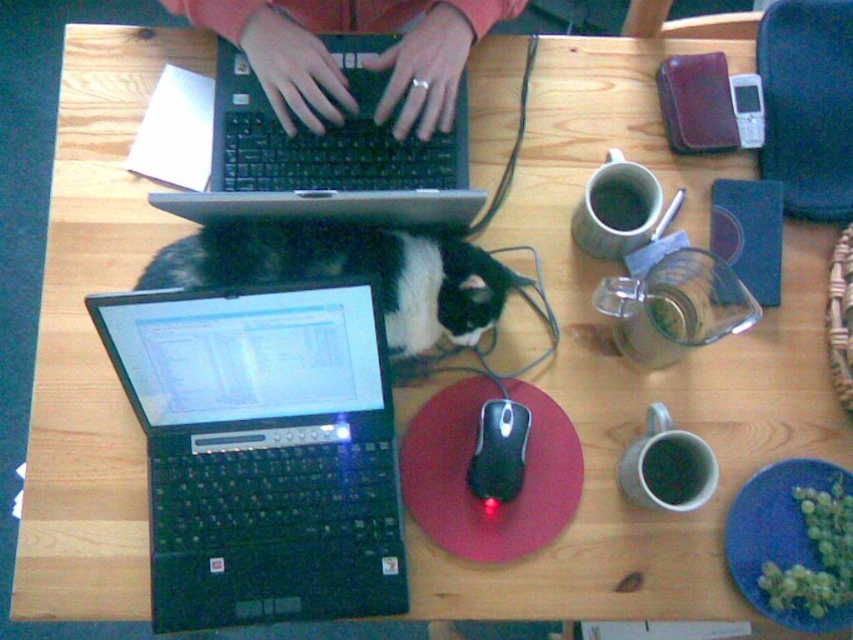
Is black fur cat at center shorter than matte black hands at center?

Yes.

Does black fur cat at center have a greater height compared to matte black hands at center?

No.

Locate an element on the screen. The width and height of the screenshot is (853, 640). black fur cat at center is located at coordinates (350, 273).

Where is `black fur cat at center`? This screenshot has height=640, width=853. black fur cat at center is located at coordinates (350, 273).

Does black matte laptop at upper left have a greater width compared to matte black hands at center?

In fact, black matte laptop at upper left might be narrower than matte black hands at center.

Image resolution: width=853 pixels, height=640 pixels. What do you see at coordinates (326, 156) in the screenshot?
I see `black matte laptop at upper left` at bounding box center [326, 156].

Locate an element on the screen. The width and height of the screenshot is (853, 640). black matte laptop at upper left is located at coordinates 326,156.

This screenshot has height=640, width=853. I want to click on black matte laptop at upper left, so click(x=326, y=156).

Is point (276, 618) positioned after point (486, 410)?

That is False.

Who is positioned more to the left, black plastic laptop at center or black plastic mouse at center?

Positioned to the left is black plastic laptop at center.

Which is in front, point (357, 419) or point (490, 403)?

Point (490, 403)

You are a GUI agent. You are given a task and a screenshot of the screen. Output one action in this format:
    pyautogui.click(x=<x>, y=<y>)
    Task: Click on the black plastic laptop at center
    
    Given the screenshot: What is the action you would take?
    pyautogui.click(x=262, y=452)